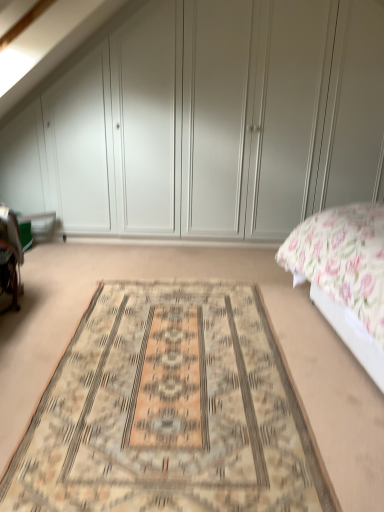
Question: Is white matte wardrobe at upper center touching beige woven rug at center?

Choices:
 (A) no
 (B) yes

Answer: (A)

Question: Can you confirm if white matte wardrobe at upper center is positioned to the left of beige woven rug at center?

Choices:
 (A) yes
 (B) no

Answer: (B)

Question: Is white matte wardrobe at upper center facing towards beige woven rug at center?

Choices:
 (A) no
 (B) yes

Answer: (B)

Question: Is white matte wardrobe at upper center positioned behind beige woven rug at center?

Choices:
 (A) yes
 (B) no

Answer: (A)

Question: Does white matte wardrobe at upper center have a lesser height compared to beige woven rug at center?

Choices:
 (A) yes
 (B) no

Answer: (B)

Question: From a real-world perspective, is white matte wardrobe at upper center positioned above or below floral fabric bed at right?

Choices:
 (A) above
 (B) below

Answer: (A)

Question: From the image's perspective, relative to floral fabric bed at right, is white matte wardrobe at upper center above or below?

Choices:
 (A) above
 (B) below

Answer: (A)

Question: Is white matte wardrobe at upper center bigger or smaller than floral fabric bed at right?

Choices:
 (A) small
 (B) big

Answer: (A)

Question: Relative to floral fabric bed at right, is white matte wardrobe at upper center in front or behind?

Choices:
 (A) front
 (B) behind

Answer: (B)

Question: In terms of height, does beige woven rug at center look taller or shorter compared to white matte wardrobe at upper center?

Choices:
 (A) tall
 (B) short

Answer: (B)

Question: Choose the correct answer: Is beige woven rug at center inside white matte wardrobe at upper center or outside it?

Choices:
 (A) outside
 (B) inside

Answer: (A)

Question: In terms of width, does beige woven rug at center look wider or thinner when compared to white matte wardrobe at upper center?

Choices:
 (A) wide
 (B) thin

Answer: (A)

Question: Based on their positions, is beige woven rug at center located to the left or right of white matte wardrobe at upper center?

Choices:
 (A) left
 (B) right

Answer: (A)

Question: Considering the positions of white matte wardrobe at upper center and beige woven rug at center in the image, is white matte wardrobe at upper center taller or shorter than beige woven rug at center?

Choices:
 (A) tall
 (B) short

Answer: (A)

Question: Would you say white matte wardrobe at upper center is to the left or to the right of beige woven rug at center in the picture?

Choices:
 (A) left
 (B) right

Answer: (B)